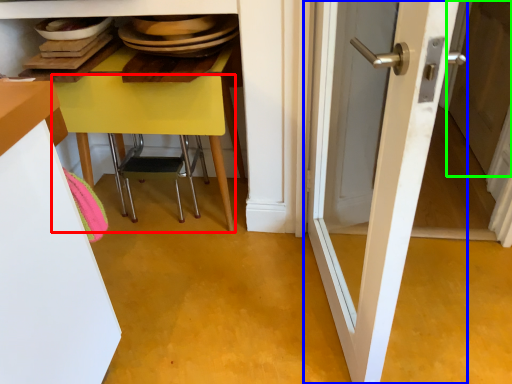
Question: Which object is the closest to the table (highlighted by a red box)? Choose among these: door (highlighted by a blue box) or screen door (highlighted by a green box).

Choices:
 (A) door
 (B) screen door

Answer: (A)